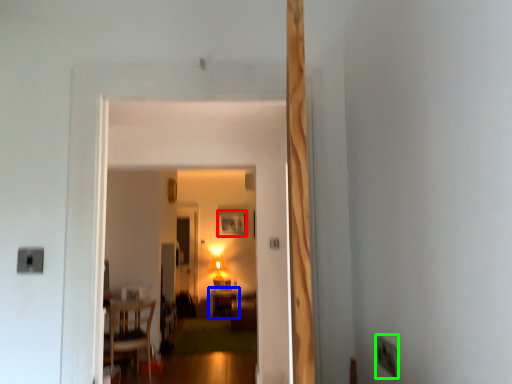
Question: Considering the real-world distances, which object is farthest from picture frame (highlighted by a red box)? table (highlighted by a blue box) or electric outlet (highlighted by a green box)?

Choices:
 (A) table
 (B) electric outlet

Answer: (B)